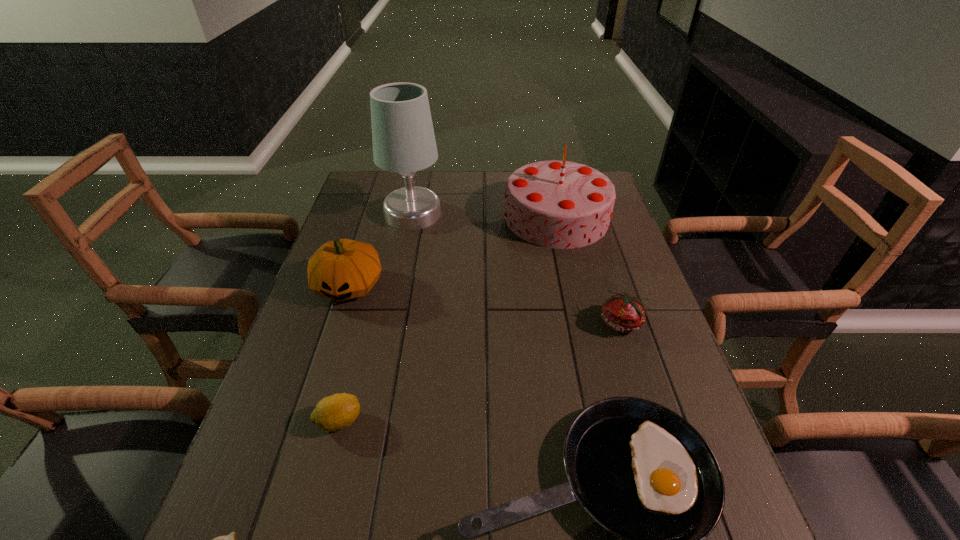
You are a GUI agent. You are given a task and a screenshot of the screen. Output one action in this format:
    pyautogui.click(x=<x>, y=<y>)
    Task: Click on the tallest object
    
    Given the screenshot: What is the action you would take?
    pyautogui.click(x=403, y=137)

The height and width of the screenshot is (540, 960). Find the location of `birthday cake`. birthday cake is located at coordinates (557, 204).

The image size is (960, 540). I want to click on gourd, so click(342, 269).

Locate an element on the screen. This screenshot has width=960, height=540. tomato is located at coordinates pyautogui.click(x=622, y=312).

The image size is (960, 540). I want to click on the taller lemon, so click(x=335, y=412).

This screenshot has width=960, height=540. What are the coordinates of `the right lemon` in the screenshot? It's located at (335, 412).

You are a GUI agent. You are given a task and a screenshot of the screen. Output one action in this format:
    pyautogui.click(x=<x>, y=<y>)
    Task: Click on the free space located 0.350m on the base of the lampshade
    This screenshot has height=540, width=960.
    Given the screenshot: What is the action you would take?
    pyautogui.click(x=548, y=214)

What are the coordinates of `blank area located 0.240m on the front of the second tallest object` in the screenshot? It's located at (577, 308).

The image size is (960, 540). In order to click on free space located on the side of the gourd with the carved face in this screenshot , I will do `click(324, 363)`.

You are a GUI agent. You are given a task and a screenshot of the screen. Output one action in this format:
    pyautogui.click(x=<x>, y=<y>)
    Task: Click on the free region located on the left of the tomato
    This screenshot has width=960, height=540.
    Given the screenshot: What is the action you would take?
    pyautogui.click(x=498, y=323)